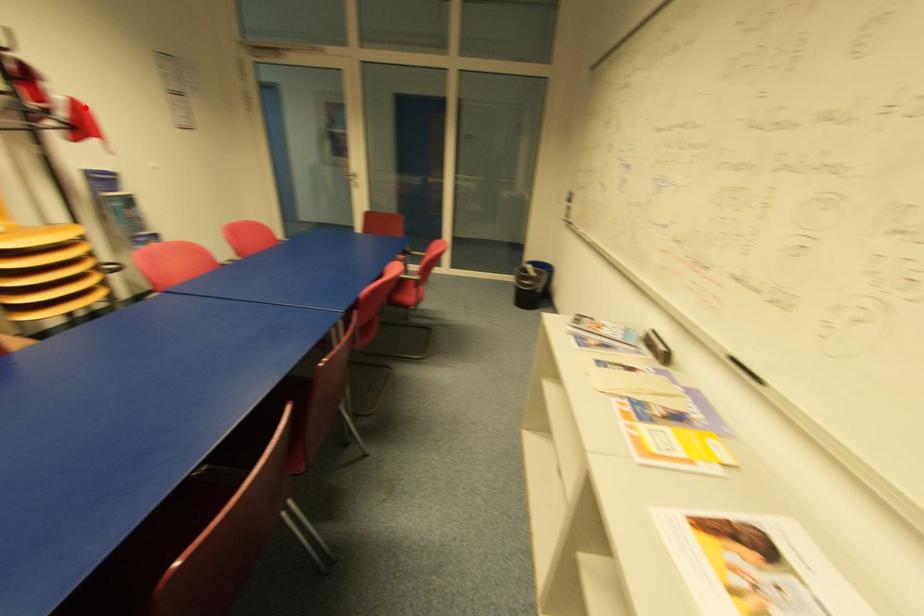
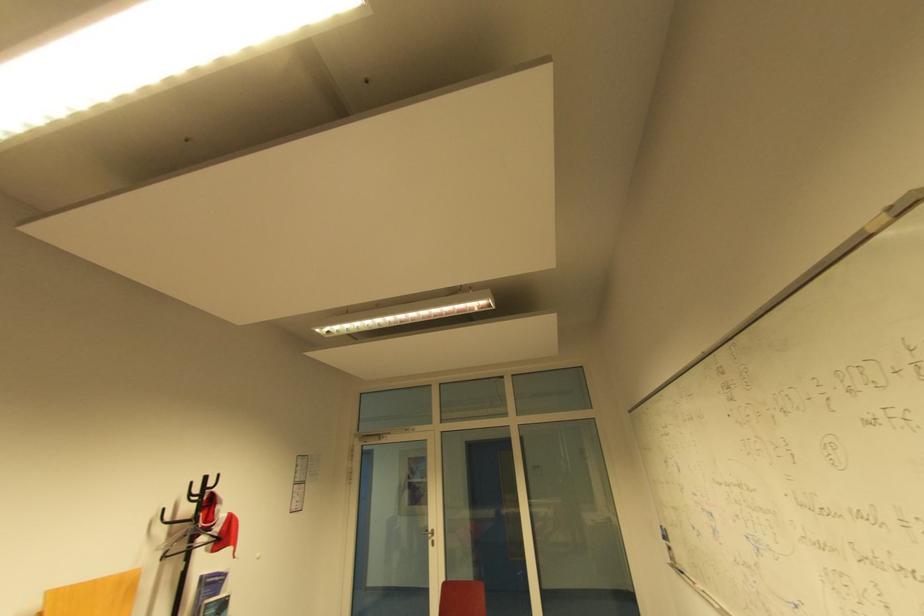
In the second image, find the point that corresponds to the highlighted location in the first image.

(235, 521)